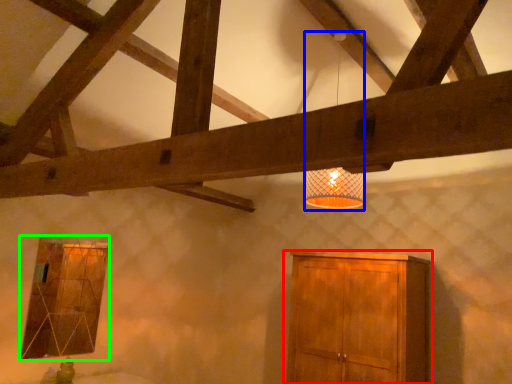
Question: Which object is the farthest from cupboard (highlighted by a red box)? Choose among these: lamp (highlighted by a blue box) or window (highlighted by a green box).

Choices:
 (A) lamp
 (B) window

Answer: (B)